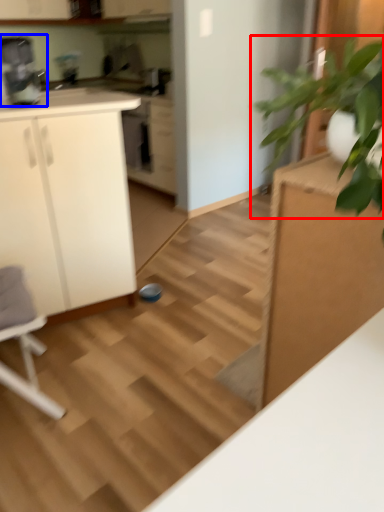
Question: Which point is further to the camera, houseplant (highlighted by a red box) or coffee machine (highlighted by a blue box)?

Choices:
 (A) houseplant
 (B) coffee machine

Answer: (B)